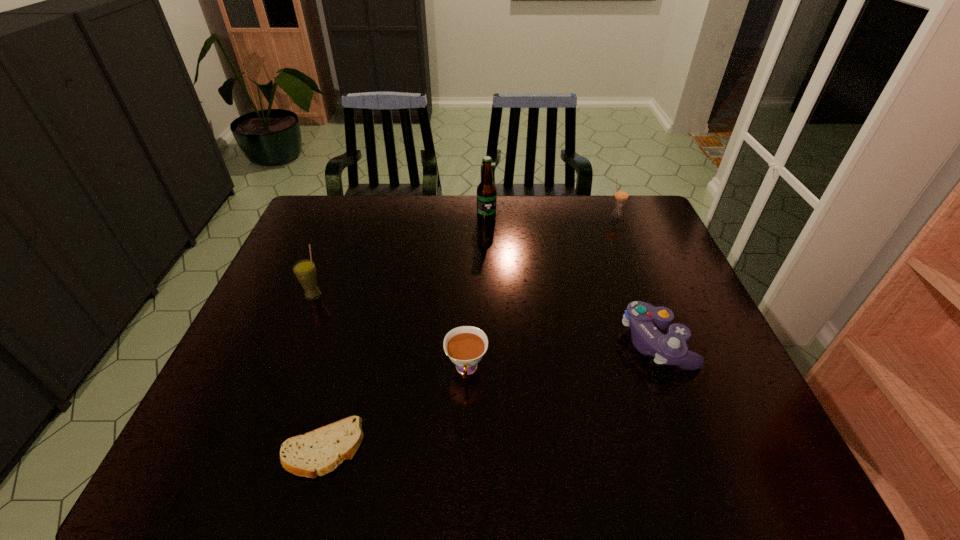
Where is `vacant area that lies between the beer bottle and the pita bread`? The image size is (960, 540). vacant area that lies between the beer bottle and the pita bread is located at coordinates (404, 334).

This screenshot has width=960, height=540. What are the coordinates of `free point between the teacup and the shorter straw` in the screenshot? It's located at (541, 293).

Identify the location of vacant region between the fourth shortest object and the control. (x=636, y=280).

The image size is (960, 540). Find the location of `vacant area that lies between the farther straw and the teacup`. vacant area that lies between the farther straw and the teacup is located at coordinates (541, 293).

Locate an element on the screen. empty space between the third farthest object and the beer bottle is located at coordinates click(x=400, y=256).

Locate an element on the screen. The height and width of the screenshot is (540, 960). free space between the teacup and the control is located at coordinates (562, 356).

Locate an element on the screen. The height and width of the screenshot is (540, 960). free point between the control and the right straw is located at coordinates (636, 280).

Where is `object that is the fifth closest one to the right straw`? object that is the fifth closest one to the right straw is located at coordinates (318, 452).

This screenshot has width=960, height=540. I want to click on object that is the closest one to the right straw, so click(486, 191).

Locate an element on the screen. Image resolution: width=960 pixels, height=540 pixels. free location that satisfies the following two spatial constraints: 1. on the back side of the third farthest object; 2. on the left side of the right straw is located at coordinates (345, 217).